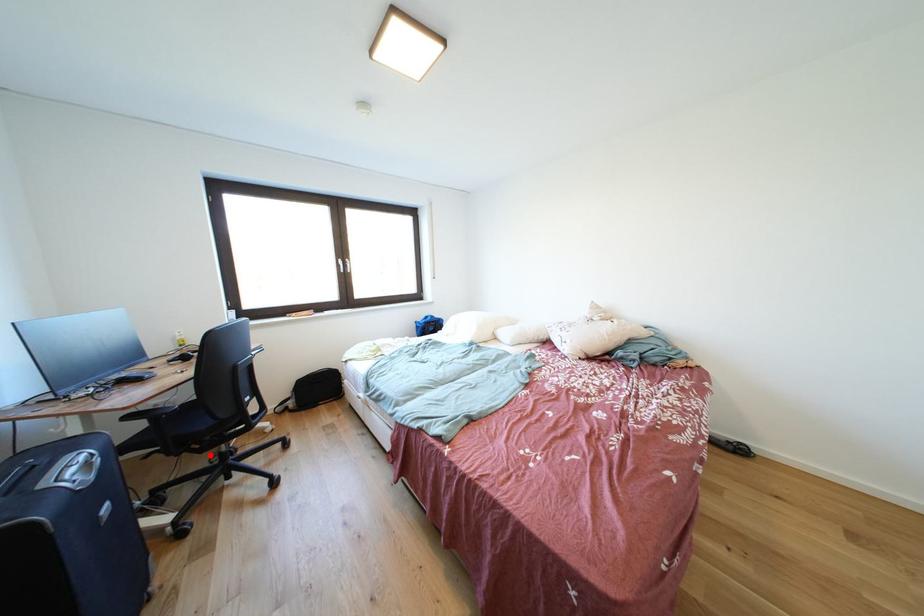
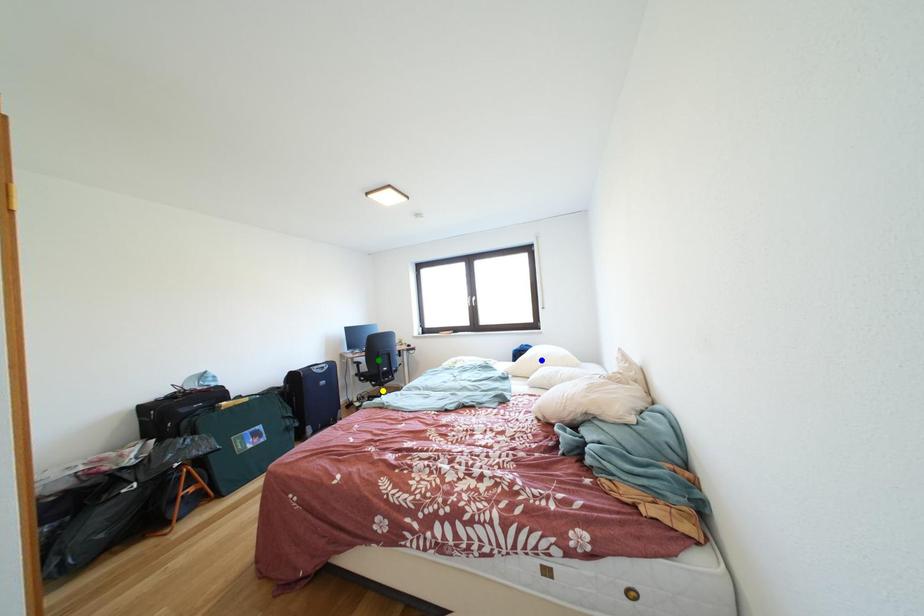
Question: I am providing you with two images of the same scene from different viewpoints. A red point is marked on the first image. You are given multiple points on the second image. Which point in image 2 is actually the same real-world point as the red point in image 1?

Choices:
 (A) green point
 (B) yellow point
 (C) blue point

Answer: (B)